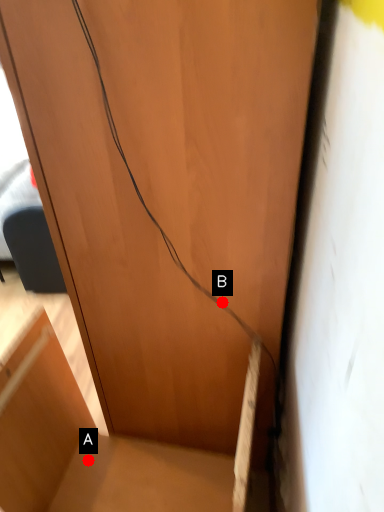
Question: Two points are circled on the image, labeled by A and B beside each circle. Which point is further to the camera?

Choices:
 (A) A is further
 (B) B is further

Answer: (A)